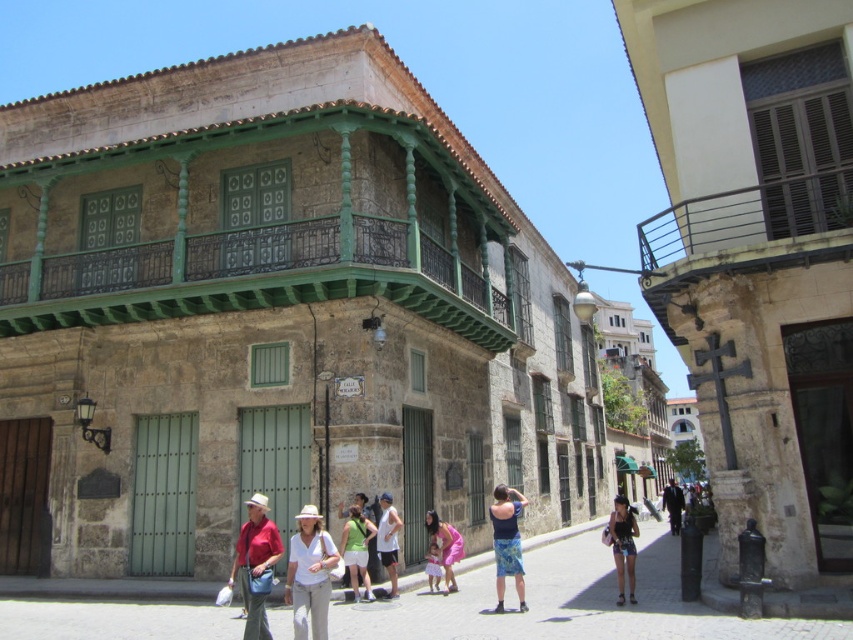
Does green painted wood at upper center have a larger size compared to pink fabric dress at center?

Yes, green painted wood at upper center is bigger than pink fabric dress at center.

Is point (428, 288) farther from camera compared to point (439, 554)?

That is True.

Identify the location of green painted wood at upper center. (263, 300).

Is matte red shirt at center further to camera compared to dark blue jeans at center?

No, matte red shirt at center is closer to the viewer.

What do you see at coordinates (254, 564) in the screenshot? I see `matte red shirt at center` at bounding box center [254, 564].

At what (x,y) coordinates should I click in order to perform the action: click on matte red shirt at center. Please return your answer as a coordinate pair (x, y). The width and height of the screenshot is (853, 640). Looking at the image, I should click on (254, 564).

Looking at this image, does green painted wood at upper center have a larger size compared to white matte hat at center?

Indeed, green painted wood at upper center has a larger size compared to white matte hat at center.

Is green painted wood at upper center smaller than white matte hat at center?

No, green painted wood at upper center is not smaller than white matte hat at center.

This screenshot has height=640, width=853. What are the coordinates of `green painted wood at upper center` in the screenshot? It's located at (263, 300).

Find the location of a particular element. The height and width of the screenshot is (640, 853). green painted wood at upper center is located at coordinates (263, 300).